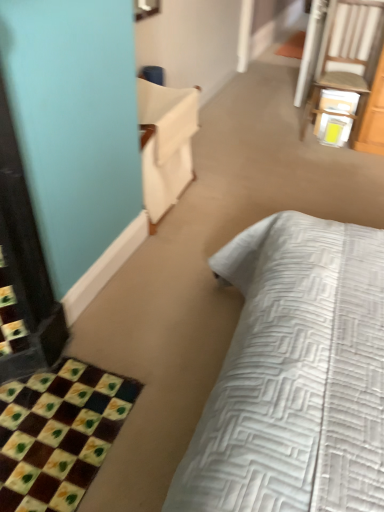
Question: From a real-world perspective, does white wood chair at upper right stand above white fabric armchair at upper left?

Choices:
 (A) no
 (B) yes

Answer: (B)

Question: Is the surface of white wood chair at upper right in direct contact with white fabric armchair at upper left?

Choices:
 (A) no
 (B) yes

Answer: (A)

Question: From a real-world perspective, is white wood chair at upper right beneath white fabric armchair at upper left?

Choices:
 (A) yes
 (B) no

Answer: (B)

Question: Is white wood chair at upper right at the right side of white fabric armchair at upper left?

Choices:
 (A) yes
 (B) no

Answer: (A)

Question: Can you confirm if white wood chair at upper right is positioned to the left of white fabric armchair at upper left?

Choices:
 (A) no
 (B) yes

Answer: (A)

Question: From the image's perspective, is checkerboard fabric bath mat at lower left positioned above or below white fabric armchair at upper left?

Choices:
 (A) above
 (B) below

Answer: (B)

Question: Visually, is checkerboard fabric bath mat at lower left positioned to the left or to the right of white fabric armchair at upper left?

Choices:
 (A) left
 (B) right

Answer: (A)

Question: Is checkerboard fabric bath mat at lower left inside the boundaries of white fabric armchair at upper left, or outside?

Choices:
 (A) outside
 (B) inside

Answer: (A)

Question: Considering the positions of checkerboard fabric bath mat at lower left and white fabric armchair at upper left in the image, is checkerboard fabric bath mat at lower left bigger or smaller than white fabric armchair at upper left?

Choices:
 (A) small
 (B) big

Answer: (A)

Question: Is white wood chair at upper right taller or shorter than checkerboard fabric bath mat at lower left?

Choices:
 (A) short
 (B) tall

Answer: (B)

Question: From a real-world perspective, is white wood chair at upper right physically located above or below checkerboard fabric bath mat at lower left?

Choices:
 (A) below
 (B) above

Answer: (B)

Question: Which is correct: white wood chair at upper right is inside checkerboard fabric bath mat at lower left, or outside of it?

Choices:
 (A) outside
 (B) inside

Answer: (A)

Question: From the image's perspective, is white wood chair at upper right positioned above or below checkerboard fabric bath mat at lower left?

Choices:
 (A) below
 (B) above

Answer: (B)

Question: Relative to white wood chair at upper right, is checkerboard fabric bath mat at lower left in front or behind?

Choices:
 (A) front
 (B) behind

Answer: (A)

Question: Which is correct: checkerboard fabric bath mat at lower left is inside white wood chair at upper right, or outside of it?

Choices:
 (A) inside
 (B) outside

Answer: (B)